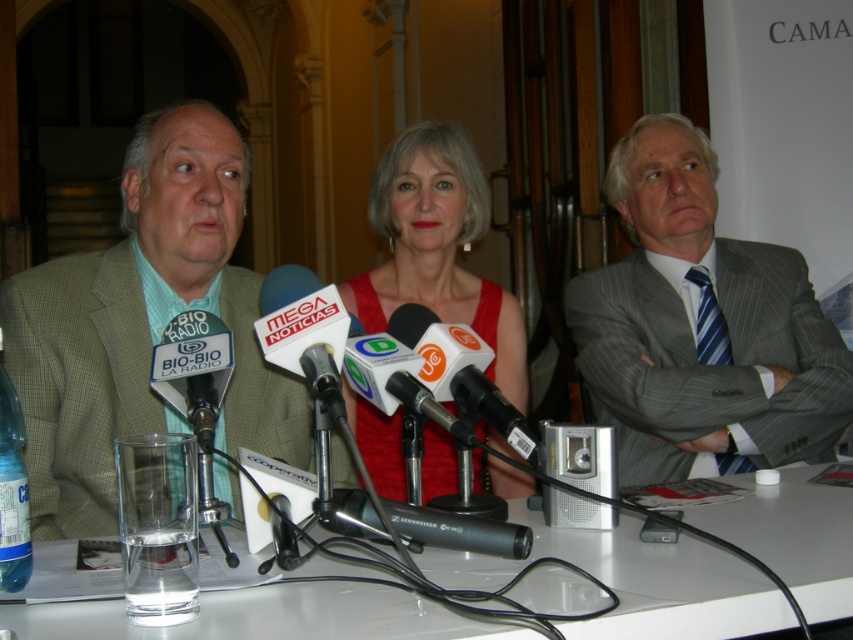
Question: Can you confirm if gray pinstripe suit at center is thinner than green checkered suit at left?

Choices:
 (A) no
 (B) yes

Answer: (A)

Question: Which point appears closest to the camera in this image?

Choices:
 (A) (399, 230)
 (B) (419, 513)

Answer: (B)

Question: Which point is farther to the camera?

Choices:
 (A) (143, 358)
 (B) (747, 502)
 (C) (428, 545)
 (D) (822, 332)

Answer: (D)

Question: Where is clear glass table at center located in relation to red satin dress at center in the image?

Choices:
 (A) above
 (B) below

Answer: (B)

Question: Which of the following is the farthest from the observer?

Choices:
 (A) clear glass table at center
 (B) green checkered suit at left
 (C) white plastic microphone at center

Answer: (B)

Question: Is clear glass table at center below white plastic microphone at center?

Choices:
 (A) yes
 (B) no

Answer: (A)